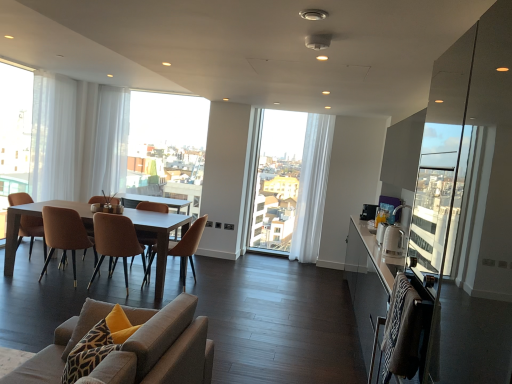
Question: Is matte wooden table at center at the back of white sheer curtain at left, acting as the 2th window screen starting from the right?

Choices:
 (A) no
 (B) yes

Answer: (A)

Question: Considering the relative sizes of white sheer curtain at left, the 2th window screen in the back-to-front sequence, and matte wooden table at center in the image provided, is white sheer curtain at left, the 2th window screen in the back-to-front sequence, taller than matte wooden table at center?

Choices:
 (A) yes
 (B) no

Answer: (A)

Question: Is white sheer curtain at left, which ranks as the 1th window screen in left-to-right order, positioned behind matte wooden table at center?

Choices:
 (A) yes
 (B) no

Answer: (A)

Question: Would you say white sheer curtain at left, which ranks as the 1th window screen in left-to-right order, is outside matte wooden table at center?

Choices:
 (A) no
 (B) yes

Answer: (B)

Question: Is white sheer curtain at left, the 2th window screen in the back-to-front sequence, beside matte wooden table at center?

Choices:
 (A) yes
 (B) no

Answer: (B)

Question: Considering the positions of white sheer curtain at left, arranged as the first curtain when viewed from the left, and white sheer curtain at left, acting as the 1th window screen starting from the front, in the image, is white sheer curtain at left, arranged as the first curtain when viewed from the left, taller or shorter than white sheer curtain at left, acting as the 1th window screen starting from the front,?

Choices:
 (A) tall
 (B) short

Answer: (A)

Question: From the image's perspective, is white sheer curtain at left, which is counted as the 3th curtain, starting from the right, above or below white sheer curtain at left, acting as the 1th window screen starting from the front?

Choices:
 (A) above
 (B) below

Answer: (A)

Question: Looking at the image, does white sheer curtain at left, which is counted as the 3th curtain, starting from the right, seem bigger or smaller compared to white sheer curtain at left, acting as the 2th window screen starting from the right?

Choices:
 (A) small
 (B) big

Answer: (A)

Question: Is white sheer curtain at left, which is counted as the 3th curtain, starting from the right, situated inside white sheer curtain at left, the 2th window screen in the back-to-front sequence, or outside?

Choices:
 (A) outside
 (B) inside

Answer: (A)

Question: Considering the relative positions of matte wooden table at center and transparent glass window at center in the image provided, is matte wooden table at center to the left or to the right of transparent glass window at center?

Choices:
 (A) left
 (B) right

Answer: (A)

Question: Is point (162, 223) positioned closer to the camera than point (315, 175)?

Choices:
 (A) closer
 (B) farther

Answer: (A)

Question: Is matte wooden table at center in front of or behind transparent glass window at center in the image?

Choices:
 (A) behind
 (B) front

Answer: (B)

Question: From the image's perspective, is matte wooden table at center positioned above or below transparent glass window at center?

Choices:
 (A) below
 (B) above

Answer: (A)

Question: Choose the correct answer: Is white sheer curtain at left, which is counted as the 3th curtain, starting from the right, inside white sheer curtain at center, placed as the 3th curtain when sorted from left to right, or outside it?

Choices:
 (A) outside
 (B) inside

Answer: (A)

Question: From the image's perspective, relative to white sheer curtain at center, placed as the 3th curtain when sorted from left to right, is white sheer curtain at left, arranged as the first curtain when viewed from the left, above or below?

Choices:
 (A) below
 (B) above

Answer: (B)